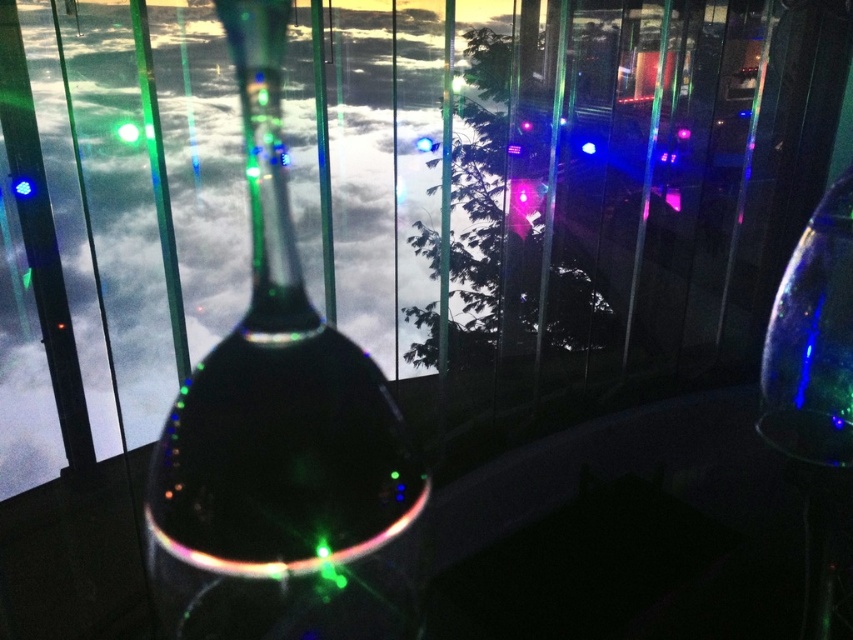
You are arranging a dinner table and want to place the transparent glass wine glass at right next to the green translucent light at center. Based on their sizes, will the wine glass fit without overlapping the light?

The transparent glass wine glass at right might be wider than green translucent light at center, so there is a possibility of overlapping if placed too close. Ensure sufficient space between them to prevent overlap.

You are standing in front of a dark reflective surface with a transparent glass wine glass at right. There are vertical glass panels in the background. If you want to see your reflection clearly, which object should you look at?

You should look at the transparent glass wine glass at right because it is positioned closer to you, located at point (814,388), making it easier to see your reflection clearly compared to the distant vertical glass panels in the background.

You are a delivery person who needs to place a 2.0 meters long box between the transparent glass bottle at center and the transparent glass wine glass at right. Can you fit the box between them without moving either object?

The distance between the transparent glass bottle at center and the transparent glass wine glass at right is 1.90 meters. Since the box is 2.0 meters long, it cannot fit between them as the space is shorter than the box.